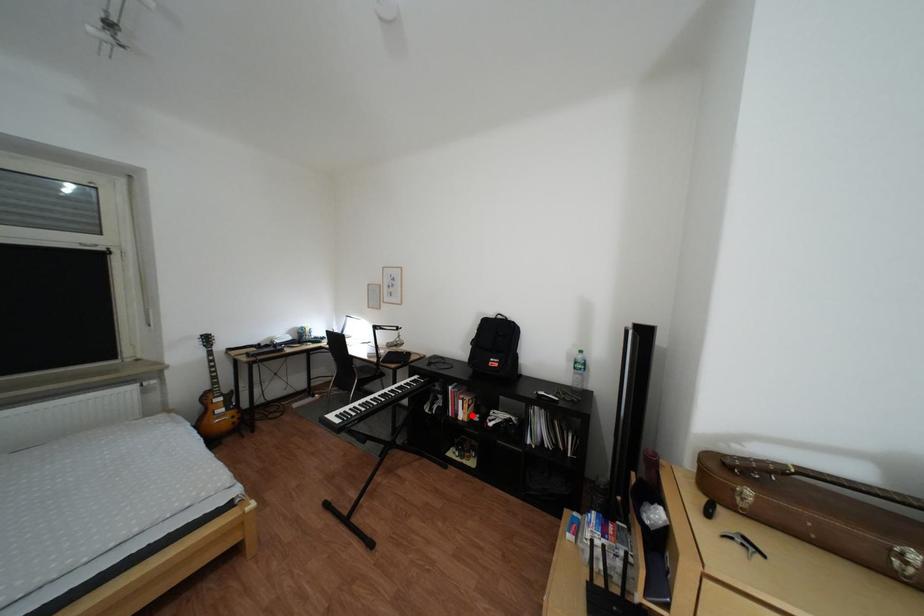
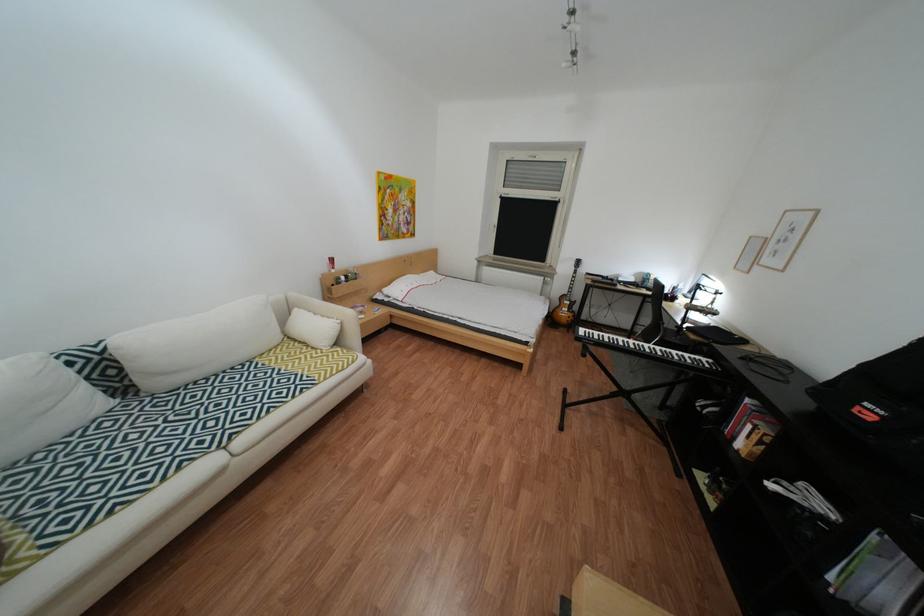
Question: I am providing you with two images of the same scene from different viewpoints. Given a red point in image1, look at the same physical point in image2. Is it:

Choices:
 (A) Closer to the viewpoint
 (B) Farther from the viewpoint

Answer: (A)